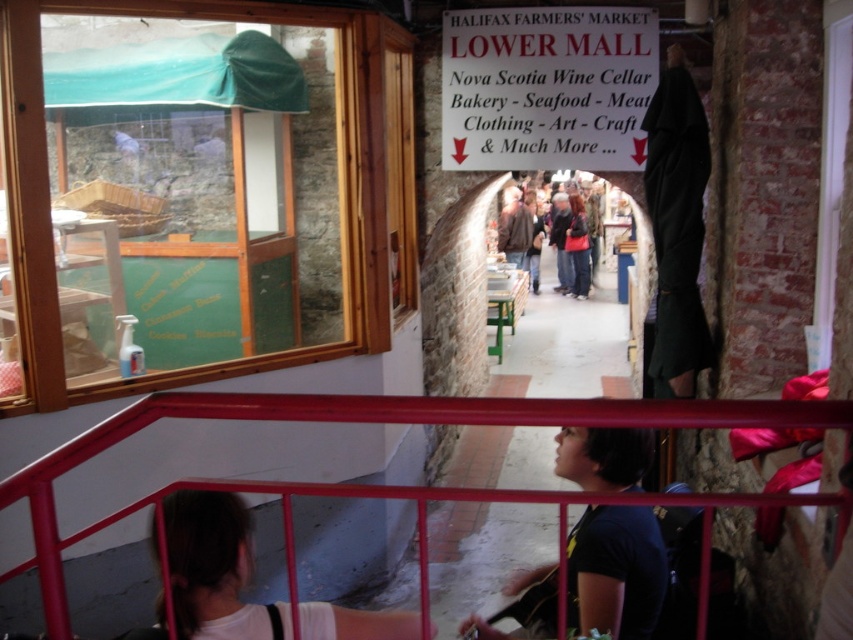
Who is more distant from viewer, [544,412] or [613,630]?

Point [613,630]

Does metallic red railing at lower center appear under dark blue t-shirt at lower center?

Actually, metallic red railing at lower center is above dark blue t-shirt at lower center.

Is point (740, 500) positioned before point (618, 564)?

Yes, it is in front of point (618, 564).

Identify the location of metallic red railing at lower center. The height and width of the screenshot is (640, 853). (357, 420).

Measure the distance between metallic red railing at lower center and camera.

metallic red railing at lower center is 3.59 feet away from camera.

Does metallic red railing at lower center have a smaller size compared to white matte shirt at lower left?

Incorrect, metallic red railing at lower center is not smaller in size than white matte shirt at lower left.

Where is `metallic red railing at lower center`? The height and width of the screenshot is (640, 853). metallic red railing at lower center is located at coordinates (357, 420).

Which is above, metallic red railing at lower center or dark blue jeans at center?

Positioned higher is dark blue jeans at center.

Can you confirm if metallic red railing at lower center is taller than dark blue jeans at center?

No, metallic red railing at lower center is not taller than dark blue jeans at center.

The width and height of the screenshot is (853, 640). In order to click on metallic red railing at lower center in this screenshot , I will do `click(357, 420)`.

Identify the location of metallic red railing at lower center. (357, 420).